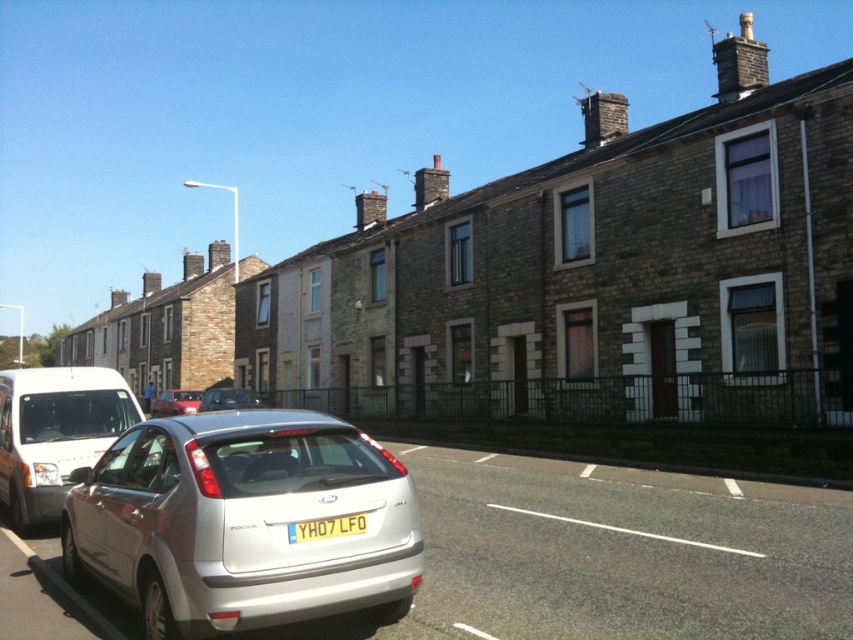
You are a delivery driver who needs to park your delivery van, which is 2 meters tall, in this street scene. You see the metallic silver sedan at center and the metallic red car at lower left. Which car is shorter and can you safely park your van next to it without hitting the roof?

The metallic silver sedan at center is shorter than the metallic red car at lower left. Since your van is 2 meters tall, you need to check the height of the metallic silver sedan at center. However, the description only states that it is shorter than the metallic red car but does not provide specific measurements. Without knowing the exact height of the sedan, it is uncertain if it is tall enough to accommodate your van. Please verify the sedan height before parking.

You are a pedestrian standing on the sidewalk next to the black metal fence. You want to cross the street to reach the terraced houses. Which car, the metallic silver sedan at center or the metallic red car at lower left, is closer to the black metal fence?

The metallic red car at lower left is closer to the black metal fence because the metallic silver sedan at center is positioned on the right side of it.